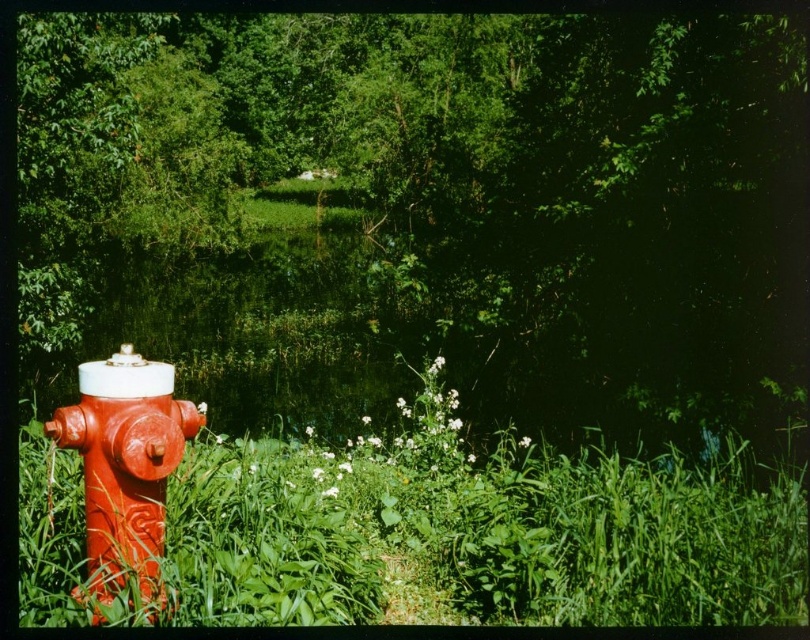
What do you see at coordinates (553, 244) in the screenshot? The height and width of the screenshot is (640, 810). I see `green leafy tree at left` at bounding box center [553, 244].

Can you confirm if green leafy tree at left is positioned to the left of shiny red fire hydrant at left?

Correct, you'll find green leafy tree at left to the left of shiny red fire hydrant at left.

Find the location of a particular element. green leafy tree at left is located at coordinates (553, 244).

Find the location of a particular element. The image size is (810, 640). green leafy tree at left is located at coordinates (553, 244).